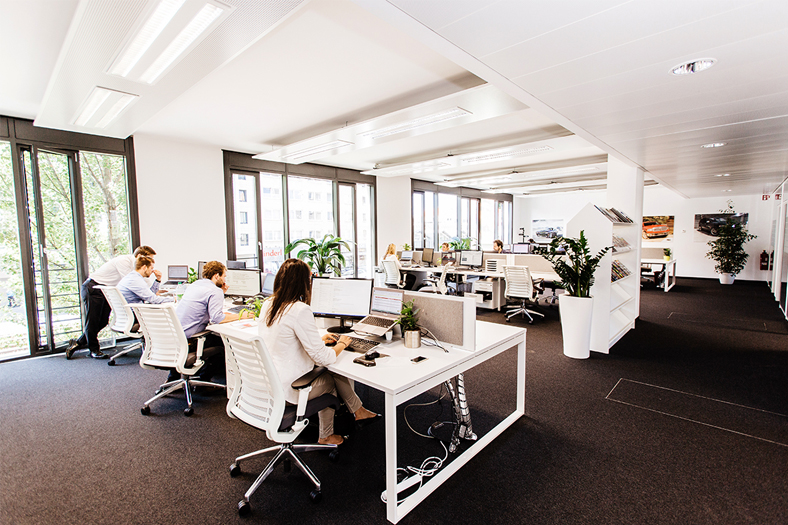
The image size is (788, 525). I want to click on lights, so click(x=198, y=43), click(x=161, y=26), click(x=103, y=89), click(x=117, y=103), click(x=433, y=116), click(x=487, y=157), click(x=507, y=176), click(x=571, y=185).